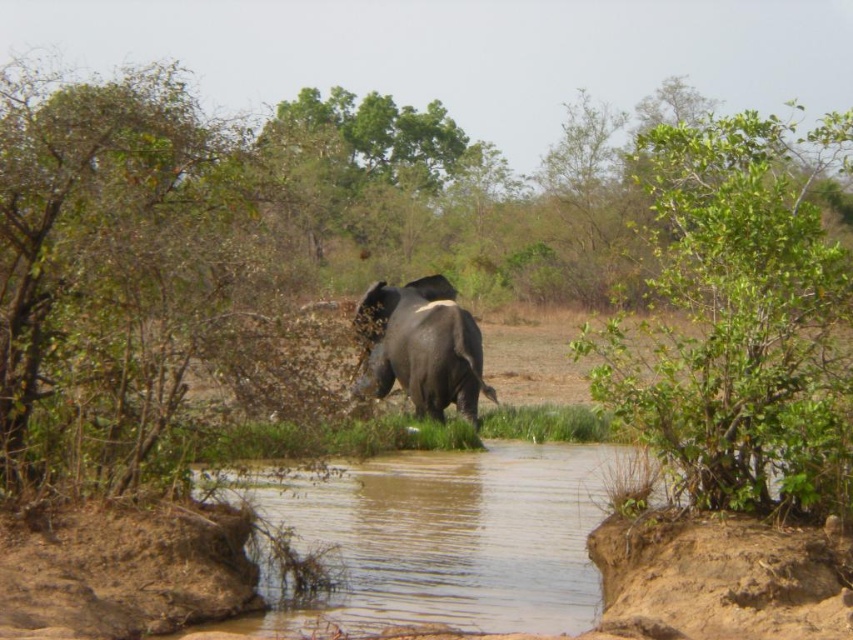
Question: Can you confirm if brown muddy water at center is wider than dark gray elephant at center?

Choices:
 (A) yes
 (B) no

Answer: (A)

Question: Can you confirm if brown muddy water at center is thinner than dark gray elephant at center?

Choices:
 (A) yes
 (B) no

Answer: (B)

Question: Does brown muddy water at center lie in front of dark gray elephant at center?

Choices:
 (A) yes
 (B) no

Answer: (A)

Question: Which of the following is the farthest from the observer?

Choices:
 (A) (494, 509)
 (B) (473, 392)

Answer: (B)

Question: Among these points, which one is farthest from the camera?

Choices:
 (A) tap(415, 332)
 (B) tap(500, 588)

Answer: (A)